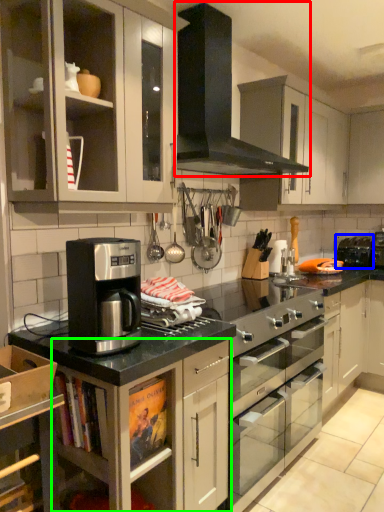
Question: Estimate the real-world distances between objects in this image. Which object is closer to gas stove (highlighted by a red box), appliance (highlighted by a blue box) or cabinetry (highlighted by a green box)?

Choices:
 (A) appliance
 (B) cabinetry

Answer: (B)